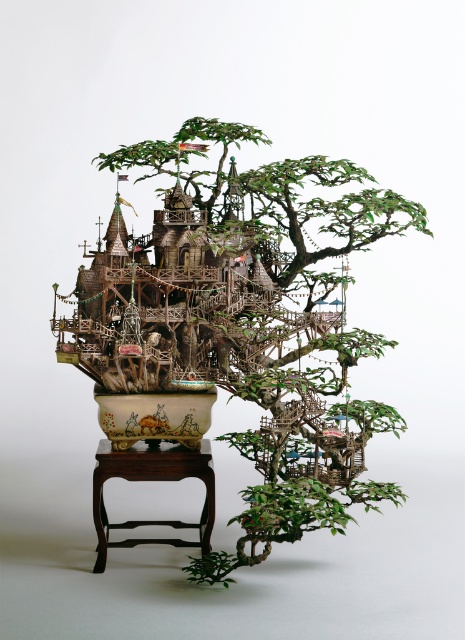
From the picture: You are a tiny gardener standing on the ground in front of the green matte tree at center and the brown wood stool at lower center. Which object is taller?

The green matte tree at center is taller than the brown wood stool at lower center.

You are a tiny gardener standing on the brown wood stool at lower center, looking up at the green matte tree at center. Which direction should you look to see the treehouse structure?

You should look upwards because the green matte tree at center is above the brown wood stool at lower center, so the treehouse structure is positioned higher up in the tree.